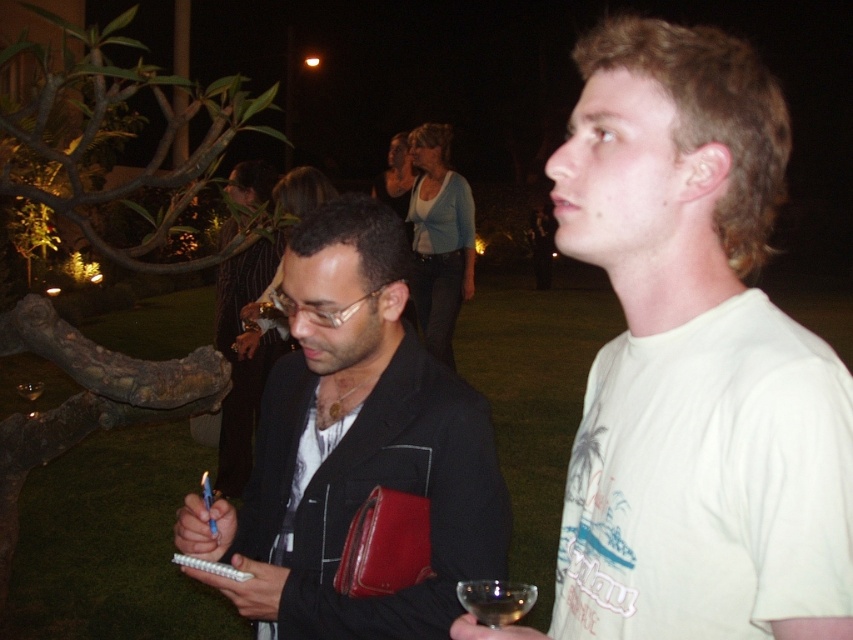
Is white cotton t-shirt at center thinner than black leather jacket at center?

Indeed, white cotton t-shirt at center has a lesser width compared to black leather jacket at center.

Is white cotton t-shirt at center to the left of black leather jacket at center from the viewer's perspective?

In fact, white cotton t-shirt at center is to the right of black leather jacket at center.

Is point (746, 172) positioned behind point (346, 310)?

No.

Locate an element on the screen. white cotton t-shirt at center is located at coordinates (694, 358).

Is point (262, 560) positioned after point (473, 586)?

Yes, it is.

Between point (318, 625) and point (515, 586), which one is positioned behind?

The point (318, 625) is more distant.

Who is more distant from viewer, [293,296] or [512,588]?

The point [293,296] is behind.

Identify the location of black leather jacket at center. Image resolution: width=853 pixels, height=640 pixels. (354, 445).

Does white cotton t-shirt at center have a greater width compared to clear glass at lower center?

Yes, white cotton t-shirt at center is wider than clear glass at lower center.

Does white cotton t-shirt at center lie in front of clear glass at lower center?

That is True.

At what (x,y) coordinates should I click in order to perform the action: click on white cotton t-shirt at center. Please return your answer as a coordinate pair (x, y). Looking at the image, I should click on (694, 358).